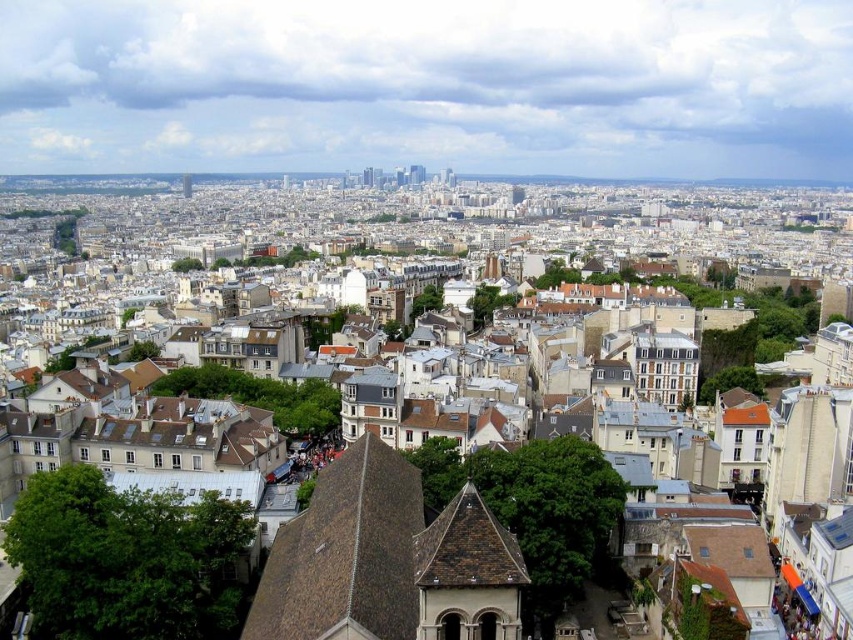
Question: Is brown tiled roofs at center closer to camera compared to brown tile roof at center?

Choices:
 (A) yes
 (B) no

Answer: (B)

Question: Estimate the real-world distances between objects in this image. Which object is closer to the brown tile roof at center?

Choices:
 (A) smooth concrete tower at upper center
 (B) brown tiled roofs at center

Answer: (B)

Question: Is brown tiled roofs at center above smooth concrete tower at upper center?

Choices:
 (A) no
 (B) yes

Answer: (A)

Question: Among these points, which one is nearest to the camera?

Choices:
 (A) (442, 620)
 (B) (181, 177)

Answer: (A)

Question: Considering the real-world distances, which object is farthest from the brown tile roof at center?

Choices:
 (A) brown tiled roofs at center
 (B) smooth concrete tower at upper center

Answer: (B)

Question: Is brown tiled roofs at center smaller than brown tile roof at center?

Choices:
 (A) yes
 (B) no

Answer: (B)